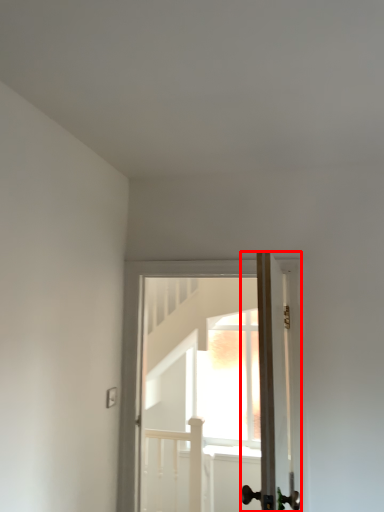
Question: Observing the image, what is the correct spatial positioning of door (annotated by the red box) in reference to door?

Choices:
 (A) right
 (B) left

Answer: (A)